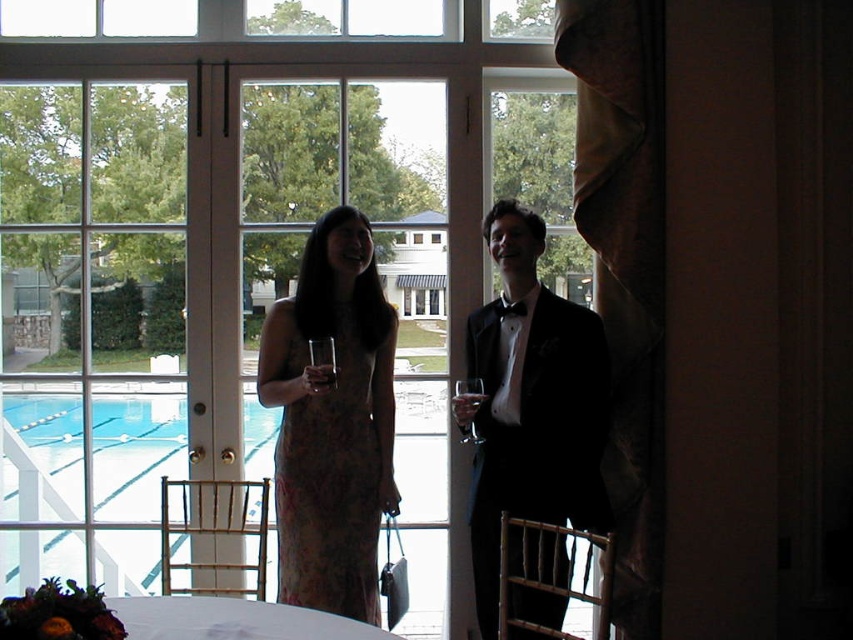
Question: Which of these objects is positioned closest to the white cloth at lower center?

Choices:
 (A) matte floral dress at center
 (B) black satin tuxedo at center
 (C) printed silk dress at center

Answer: (A)

Question: Does transparent glass window at center appear over printed silk dress at center?

Choices:
 (A) yes
 (B) no

Answer: (A)

Question: Which object is positioned farthest from the transparent glass window at center?

Choices:
 (A) white cloth at lower center
 (B) printed silk dress at center
 (C) clear glass at center

Answer: (A)

Question: Does clear glass wine glass at center lie in front of transparent glass at center?

Choices:
 (A) no
 (B) yes

Answer: (B)

Question: Which of these objects is positioned closest to the matte floral dress at center?

Choices:
 (A) printed silk dress at center
 (B) translucent glass wine at center

Answer: (A)

Question: Is white cloth at lower center to the left of translucent glass wine at center from the viewer's perspective?

Choices:
 (A) no
 (B) yes

Answer: (B)